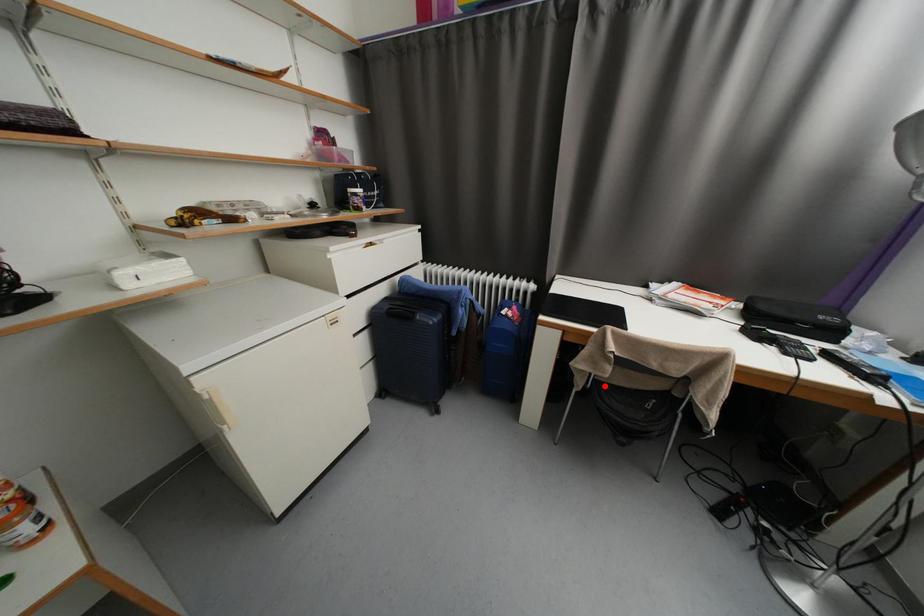
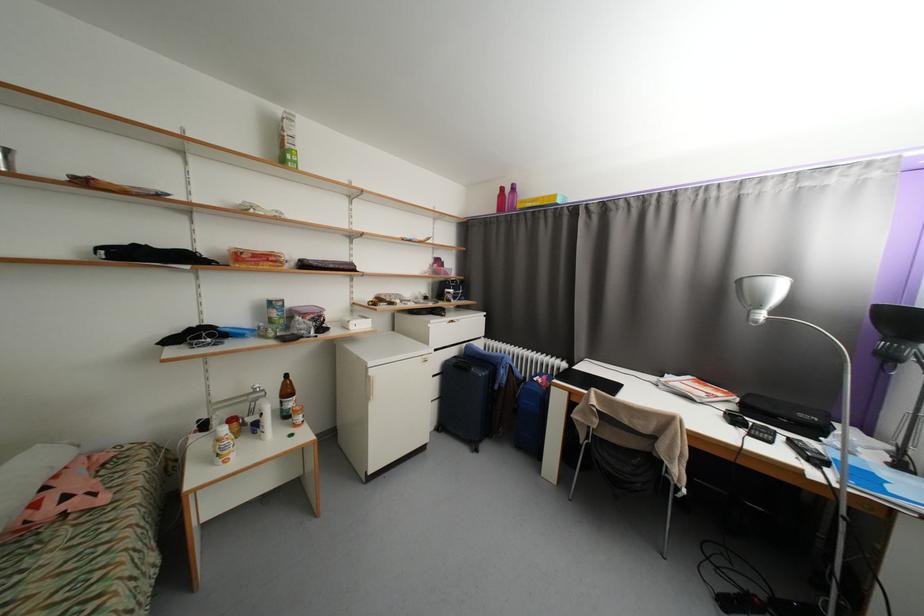
Where in the second image is the point corresponding to the highlighted location from the first image?

(603, 440)